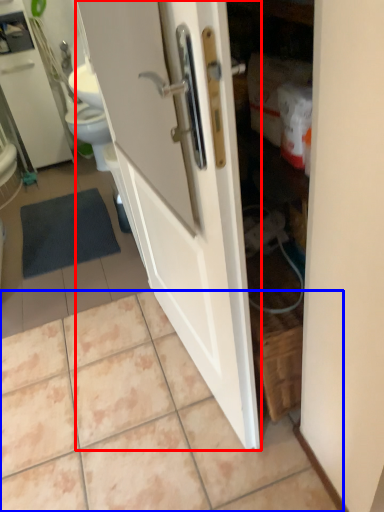
Question: Which object appears farthest to the camera in this image, door (highlighted by a red box) or ceramic tile (highlighted by a blue box)?

Choices:
 (A) door
 (B) ceramic tile

Answer: (B)